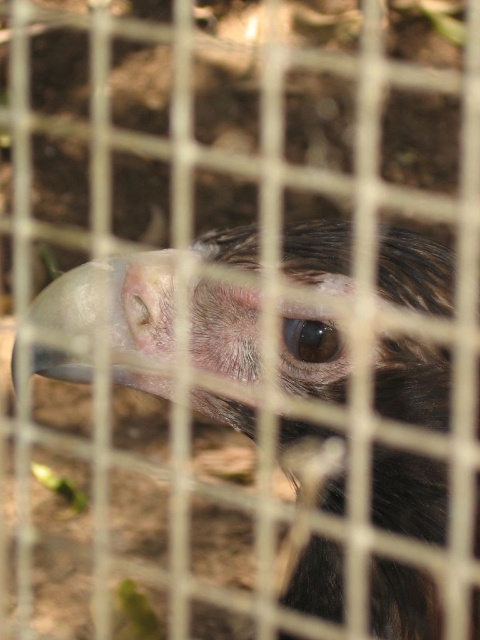
Question: Can you confirm if smooth feathered eagle at center is smaller than brown glossy eye at center?

Choices:
 (A) no
 (B) yes

Answer: (A)

Question: Which point appears closest to the camera in this image?

Choices:
 (A) (332, 337)
 (B) (388, 280)

Answer: (B)

Question: Which object is closer to the camera taking this photo?

Choices:
 (A) brown glossy eye at center
 (B) smooth feathered eagle at center

Answer: (B)

Question: Does smooth feathered eagle at center come in front of brown glossy eye at center?

Choices:
 (A) yes
 (B) no

Answer: (A)

Question: Which point is farther to the camera?

Choices:
 (A) smooth feathered eagle at center
 (B) brown glossy eye at center

Answer: (B)

Question: Can you confirm if smooth feathered eagle at center is smaller than brown glossy eye at center?

Choices:
 (A) yes
 (B) no

Answer: (B)